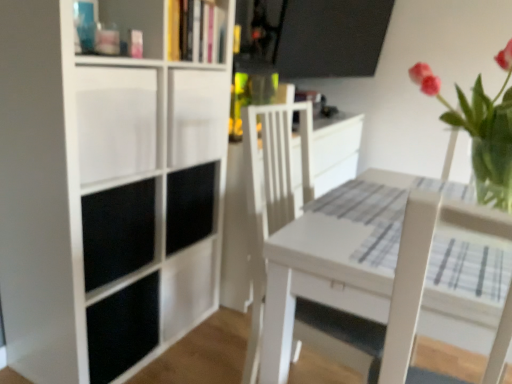
Question: From the image's perspective, is white matte cabinet at left, the second cabinet when ordered from back to front, located above white matte bookcase at left?

Choices:
 (A) yes
 (B) no

Answer: (A)

Question: Would you consider white matte cabinet at left, which ranks as the 1th cabinet in front-to-back order, to be distant from white matte bookcase at left?

Choices:
 (A) yes
 (B) no

Answer: (B)

Question: Is white matte cabinet at left, the second cabinet when ordered from back to front, shorter than white matte bookcase at left?

Choices:
 (A) no
 (B) yes

Answer: (B)

Question: Does white matte cabinet at left, the second cabinet when ordered from back to front, appear on the left side of white matte bookcase at left?

Choices:
 (A) yes
 (B) no

Answer: (A)

Question: Is the depth of white matte cabinet at left, the second cabinet when ordered from back to front, greater than that of white matte bookcase at left?

Choices:
 (A) no
 (B) yes

Answer: (B)

Question: Is point (175, 36) closer or farther from the camera than point (292, 230)?

Choices:
 (A) closer
 (B) farther

Answer: (B)

Question: From their relative heights in the image, would you say hardcover book at upper center is taller or shorter than white wood table at center?

Choices:
 (A) tall
 (B) short

Answer: (B)

Question: Considering their positions, is hardcover book at upper center located in front of or behind white wood table at center?

Choices:
 (A) behind
 (B) front

Answer: (A)

Question: From a real-world perspective, relative to white wood table at center, is hardcover book at upper center vertically above or below?

Choices:
 (A) below
 (B) above

Answer: (B)

Question: Looking at their shapes, would you say white matte cabinet at left, which ranks as the 1th cabinet in front-to-back order, is wider or thinner than black matte cabinet at center, the 1th cabinet from the back?

Choices:
 (A) wide
 (B) thin

Answer: (A)

Question: From their relative heights in the image, would you say white matte cabinet at left, which ranks as the 1th cabinet in front-to-back order, is taller or shorter than black matte cabinet at center, which is the 2th cabinet from front to back?

Choices:
 (A) tall
 (B) short

Answer: (A)

Question: From a real-world perspective, is white matte cabinet at left, which ranks as the 1th cabinet in front-to-back order, above or below black matte cabinet at center, the 1th cabinet from the back?

Choices:
 (A) above
 (B) below

Answer: (A)

Question: From the image's perspective, relative to black matte cabinet at center, which is the 2th cabinet from front to back, is white matte cabinet at left, the second cabinet when ordered from back to front, above or below?

Choices:
 (A) above
 (B) below

Answer: (A)

Question: Is hardcover book at upper center wider or thinner than white matte cabinet at left, the second cabinet when ordered from back to front?

Choices:
 (A) thin
 (B) wide

Answer: (A)

Question: Is hardcover book at upper center bigger or smaller than white matte cabinet at left, which ranks as the 1th cabinet in front-to-back order?

Choices:
 (A) small
 (B) big

Answer: (A)